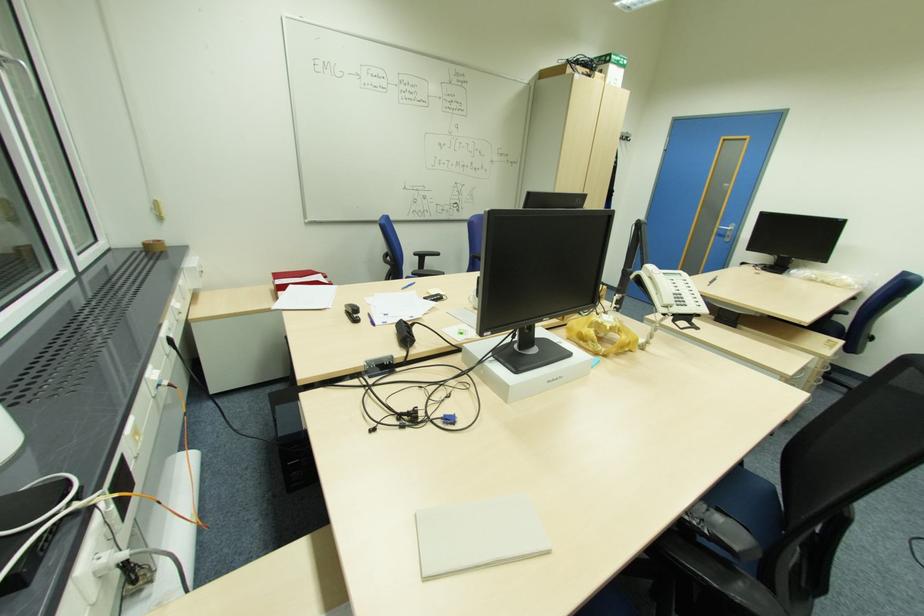
The image size is (924, 616). What are the coordinates of `white product box` in the screenshot? It's located at (525, 369).